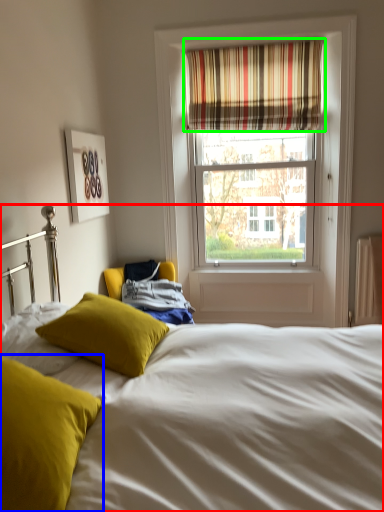
Question: Which object is the farthest from bed (highlighted by a red box)? Choose among these: pillow (highlighted by a blue box) or curtain (highlighted by a green box).

Choices:
 (A) pillow
 (B) curtain

Answer: (B)